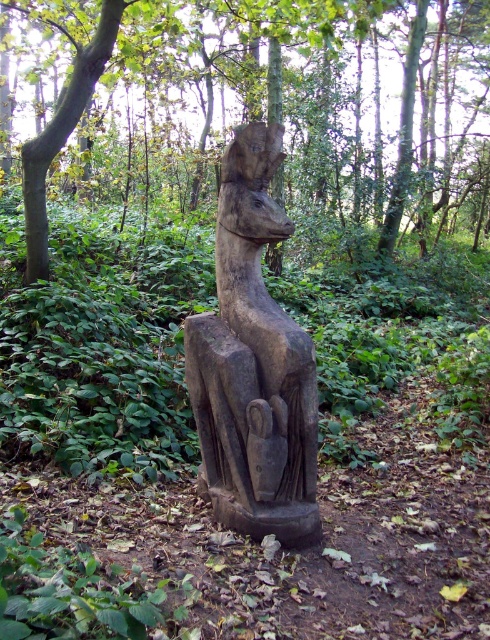
Is the position of smooth brown statue at center less distant than that of dark brown wood statue at center?

That is False.

Does smooth brown statue at center appear on the right side of dark brown wood statue at center?

Yes, smooth brown statue at center is to the right of dark brown wood statue at center.

Where is `smooth brown statue at center`? The height and width of the screenshot is (640, 490). smooth brown statue at center is located at coordinates (275, 106).